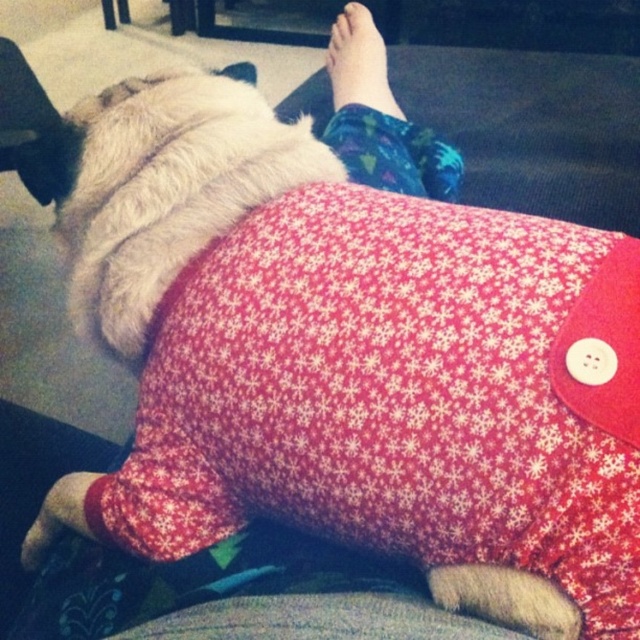
Can you confirm if red fabric pillow at center is taller than skinny bare foot at upper center?

Indeed, red fabric pillow at center has a greater height compared to skinny bare foot at upper center.

This screenshot has width=640, height=640. In order to click on red fabric pillow at center in this screenshot , I will do `click(397, 394)`.